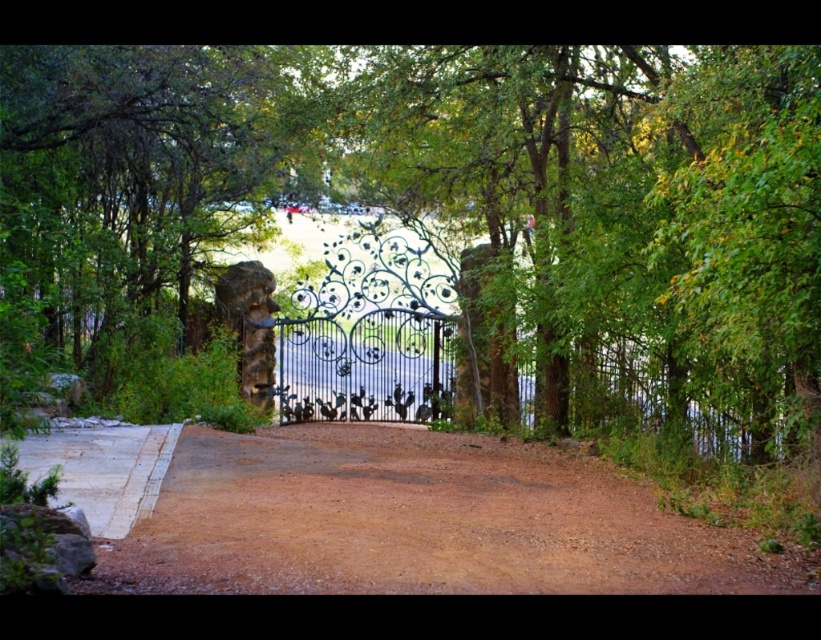
Can you confirm if brown gravel driveway at center is shorter than wrought iron gate at center?

Yes, brown gravel driveway at center is shorter than wrought iron gate at center.

The height and width of the screenshot is (640, 821). In order to click on brown gravel driveway at center in this screenshot , I will do `click(416, 522)`.

You are a GUI agent. You are given a task and a screenshot of the screen. Output one action in this format:
    pyautogui.click(x=<x>, y=<y>)
    Task: Click on the brown gravel driveway at center
    This screenshot has width=821, height=640.
    Given the screenshot: What is the action you would take?
    pyautogui.click(x=416, y=522)

This screenshot has height=640, width=821. Identify the location of green leafy tree at center. (438, 196).

Does green leafy tree at center lie in front of green leafy tree at left?

Yes, it is in front of green leafy tree at left.

Which is in front, point (83, 148) or point (173, 115)?

Point (83, 148) is in front.

Locate an element on the screen. green leafy tree at center is located at coordinates (438, 196).

Who is lower down, green leafy tree at left or wrought iron gate at center?

wrought iron gate at center

Who is positioned more to the right, green leafy tree at left or wrought iron gate at center?

From the viewer's perspective, wrought iron gate at center appears more on the right side.

Which is in front, point (72, 342) or point (531, 408)?

Point (72, 342) is in front.

I want to click on green leafy tree at left, so click(x=127, y=182).